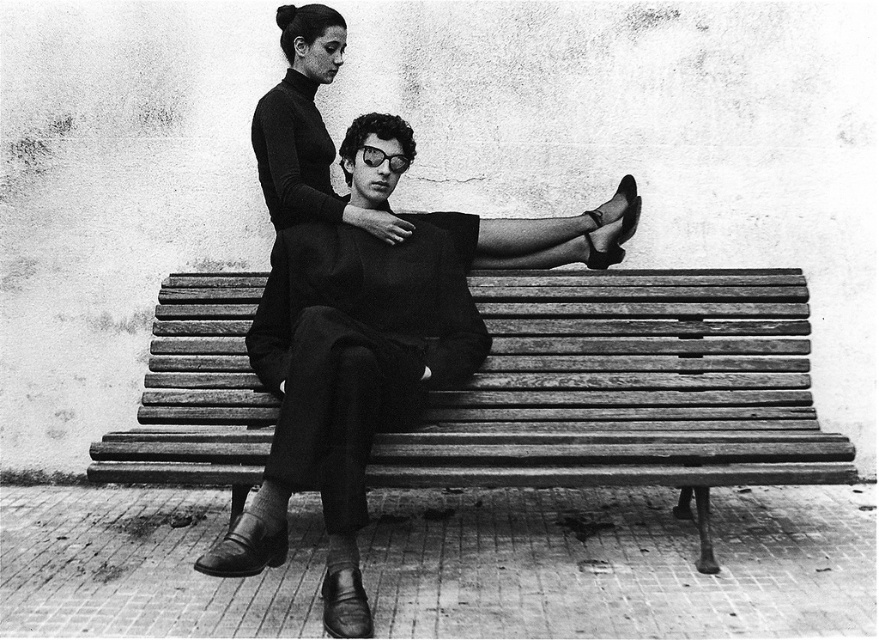
From the picture: You are trying to decide whether to place a small potted plant on the wooden bench at center. Considering the size of the smooth leather jacket at center, will there be enough space?

The wooden bench at center has a smaller size compared to the smooth leather jacket at center. Therefore, placing a small potted plant may not leave enough space if the jacket is already occupying most of the bench.